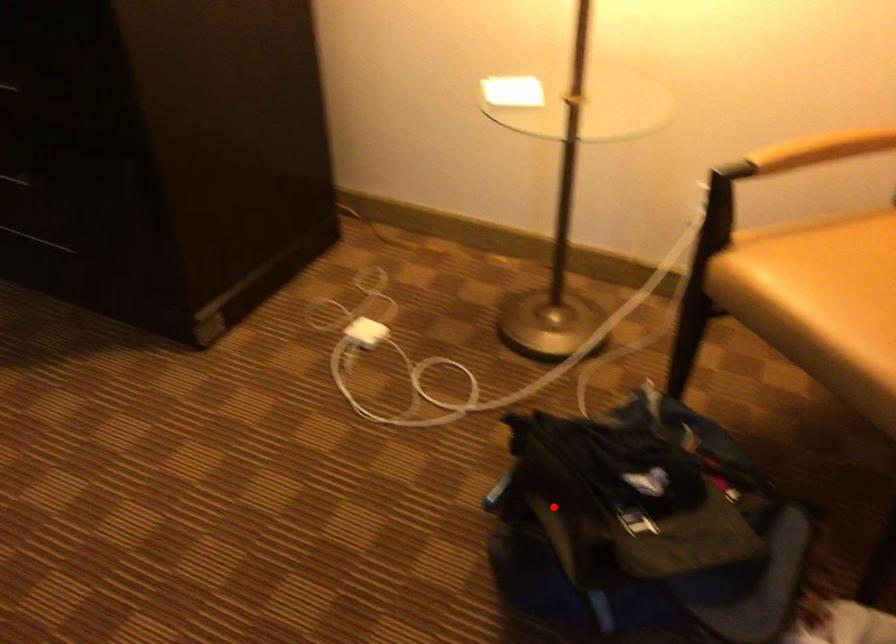
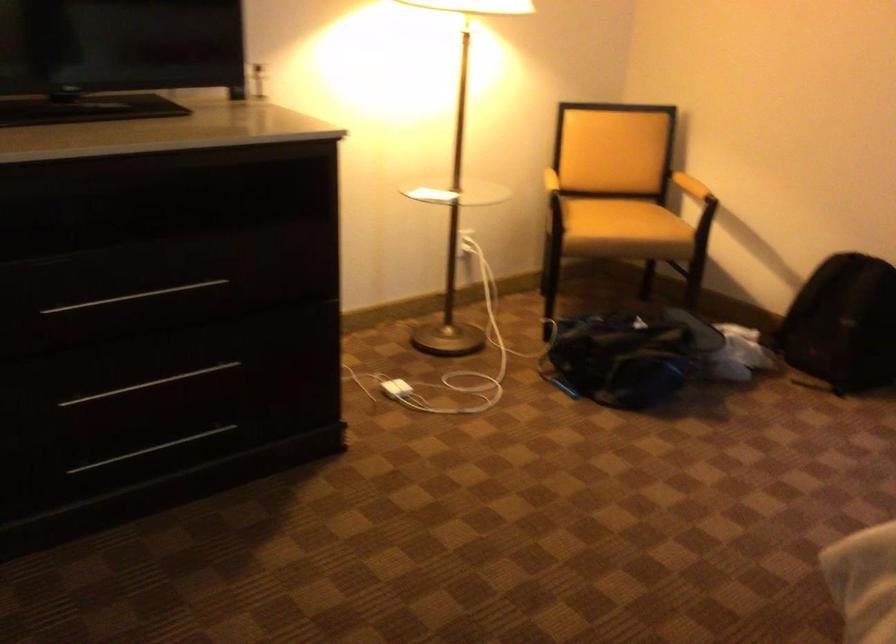
Question: I am providing you with two images of the same scene from different viewpoints. In image1, a red point is highlighted. Considering the same 3D point in image2, which of the following is correct?

Choices:
 (A) It is closer
 (B) It is farther

Answer: (B)